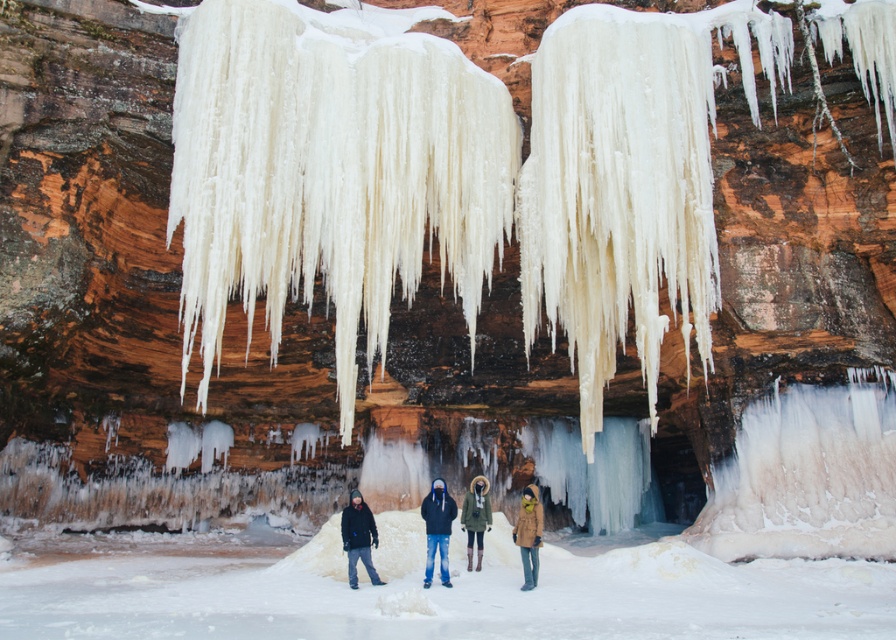
You are a photographer trying to capture a photo of the cliff with both the black matte jacket at lower left and the tan leather coat at center in the frame. Based on their heights, which person should you position closer to the camera to ensure both are fully visible in the photo?

The black matte jacket at lower left is taller than the tan leather coat at center. To ensure both are fully visible, position the person in the black matte jacket at lower left slightly closer to the camera so their height matches the tan leather coat at center in the frame.